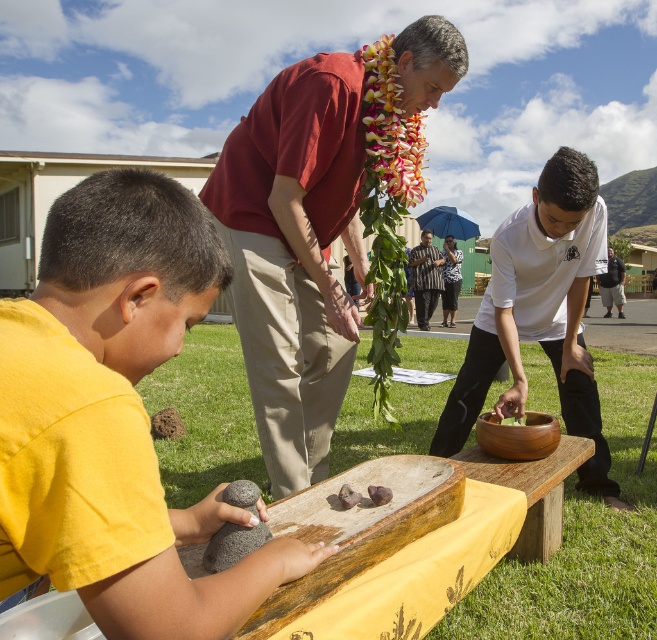
From the picture: Who is more distant from viewer, (170, 492) or (170, 417)?

Result: The point (170, 417) is behind.

Is point (194, 467) in front of point (160, 435)?

Yes, it is in front of point (160, 435).

Where is `smooth wood bowl at lower center`? The image size is (657, 640). smooth wood bowl at lower center is located at coordinates (585, 540).

Is dark gray fabric pants at center further to the viewer compared to brown rough rock at lower left?

That is True.

Which is in front, point (614, 262) or point (175, 420)?

Positioned in front is point (175, 420).

Between point (612, 272) and point (173, 435), which one is positioned behind?

The point (612, 272) is behind.

Where is `dark gray fabric pants at center`? The width and height of the screenshot is (657, 640). dark gray fabric pants at center is located at coordinates (612, 284).

Is smooth wood bowl at lower center bigger than dark gray fabric pants at center?

Incorrect, smooth wood bowl at lower center is not larger than dark gray fabric pants at center.

Between smooth wood bowl at lower center and dark gray fabric pants at center, which one is positioned higher?

dark gray fabric pants at center

Find the location of a particular element. The width and height of the screenshot is (657, 640). smooth wood bowl at lower center is located at coordinates (585, 540).

At what (x,y) coordinates should I click in order to perform the action: click on smooth wood bowl at lower center. Please return your answer as a coordinate pair (x, y). The height and width of the screenshot is (640, 657). Looking at the image, I should click on coord(585,540).